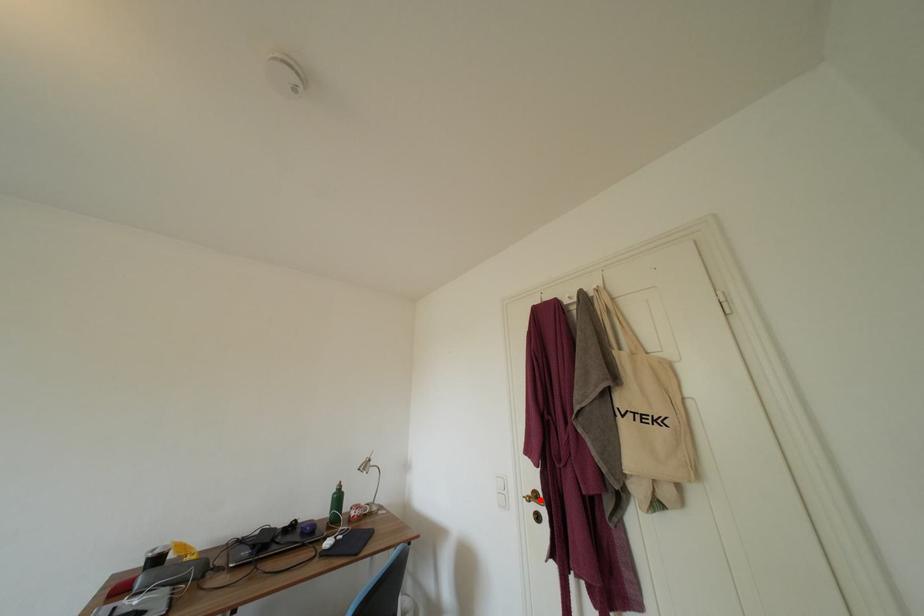
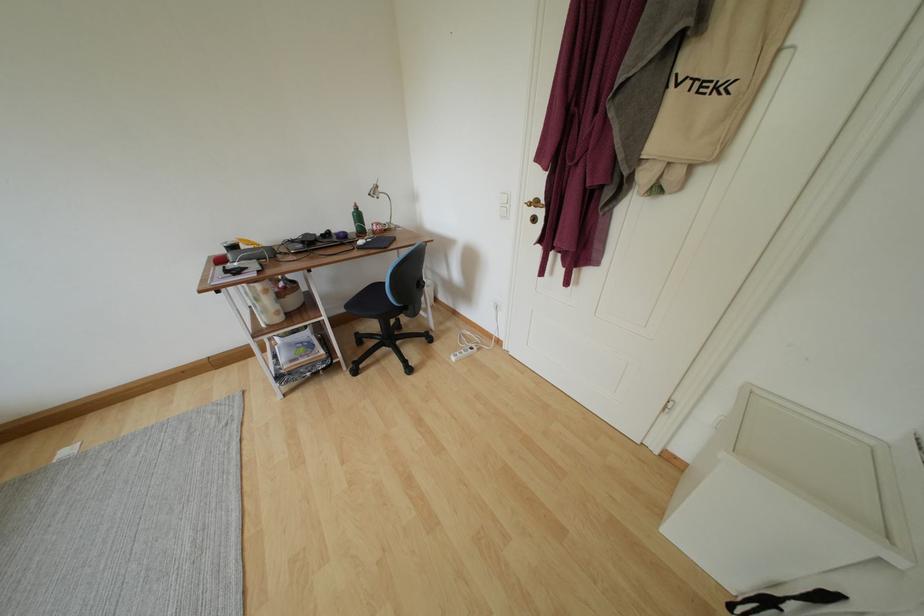
Find the pixel in the second image that matches the highlighted location in the first image.

(541, 207)